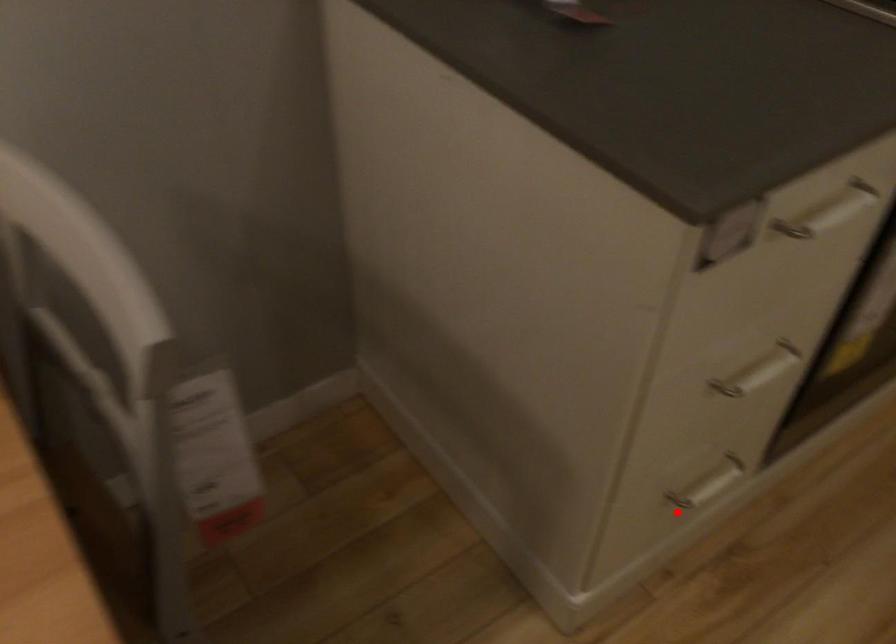
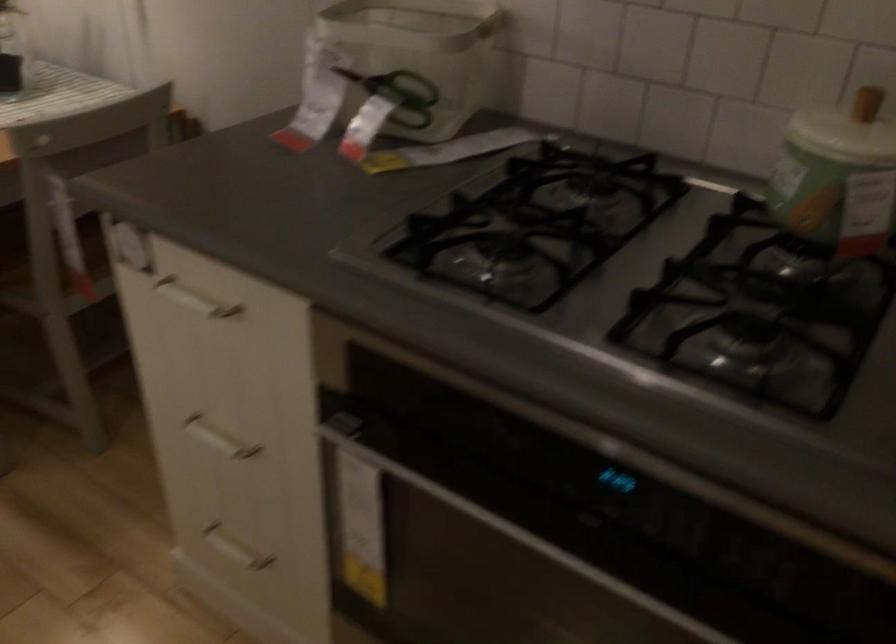
In the second image, find the point that corresponds to the highlighted location in the first image.

(234, 549)